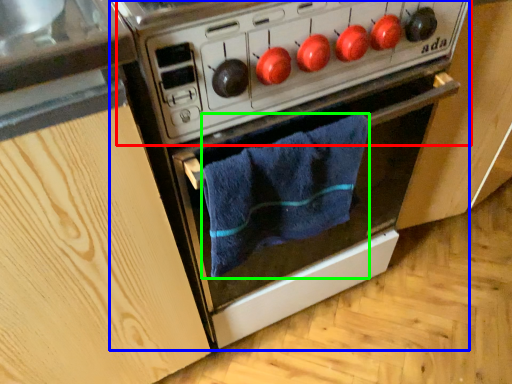
Question: Which object is positioned closest to appliance (highlighted by a red box)? Select from oven (highlighted by a blue box) and bath towel (highlighted by a green box).

Choices:
 (A) oven
 (B) bath towel

Answer: (A)